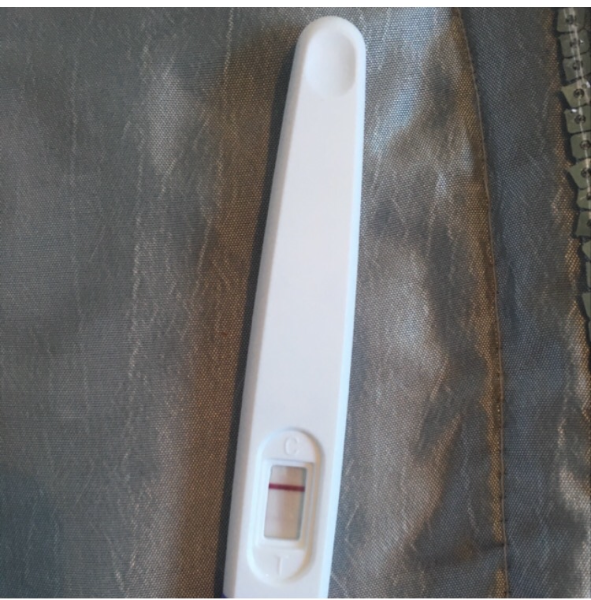
What are the coordinates of `handle` in the screenshot? It's located at (335, 134).